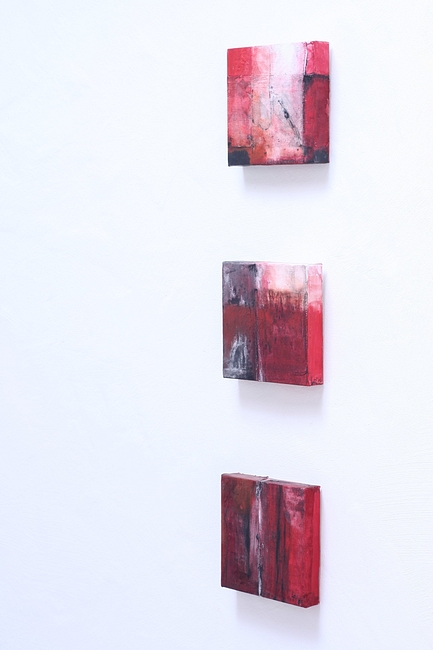
Identify the location of corner. The width and height of the screenshot is (433, 650). (293, 278).